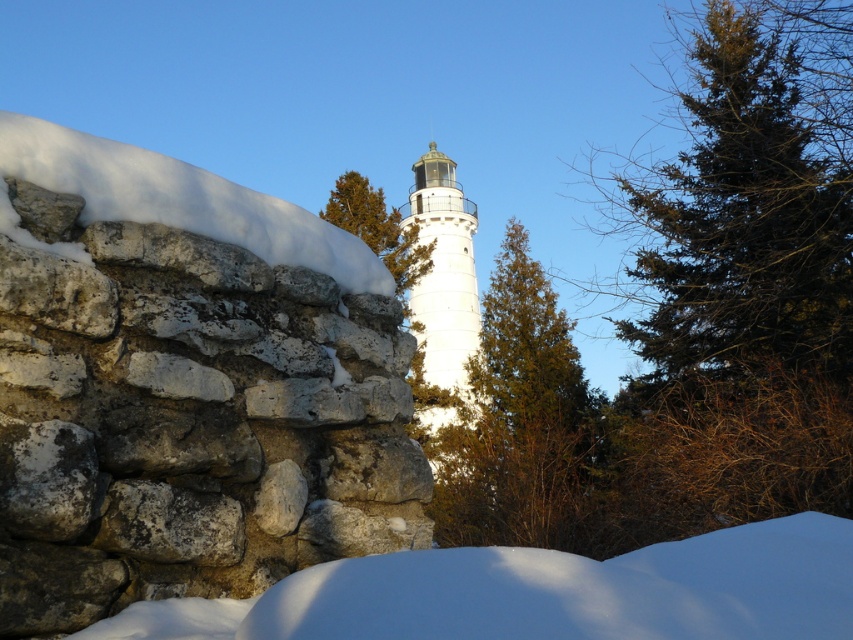
Question: Is green needle-like tree at upper right smaller than white smooth tower at center?

Choices:
 (A) yes
 (B) no

Answer: (B)

Question: Which object appears farthest from the camera in this image?

Choices:
 (A) white fluffy snow at lower center
 (B) white powdery snow at left
 (C) green textured tree at center

Answer: (C)

Question: From the image, what is the correct spatial relationship of green textured tree at center in relation to white smooth tower at center?

Choices:
 (A) left
 (B) right

Answer: (B)

Question: Estimate the real-world distances between objects in this image. Which object is closer to the green needle-like tree at upper right?

Choices:
 (A) white smooth tower at center
 (B) green textured tree at center
 (C) white powdery snow at left

Answer: (B)

Question: Based on their relative distances, which object is farther from the green textured tree at center?

Choices:
 (A) green textured pine tree at center
 (B) white smooth tower at center

Answer: (B)

Question: Is white powdery snow at left below green textured pine tree at center?

Choices:
 (A) no
 (B) yes

Answer: (B)